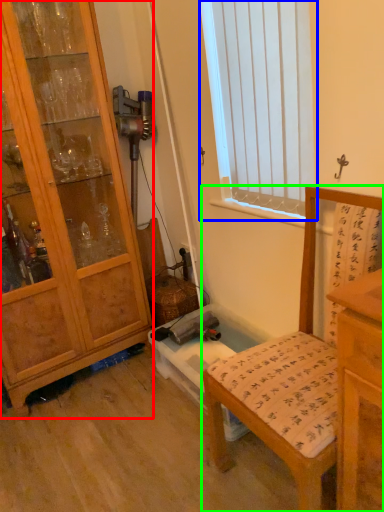
Question: Which object is positioned closest to cabinetry (highlighted by a red box)? Select from window (highlighted by a blue box) and chair (highlighted by a green box).

Choices:
 (A) window
 (B) chair

Answer: (A)